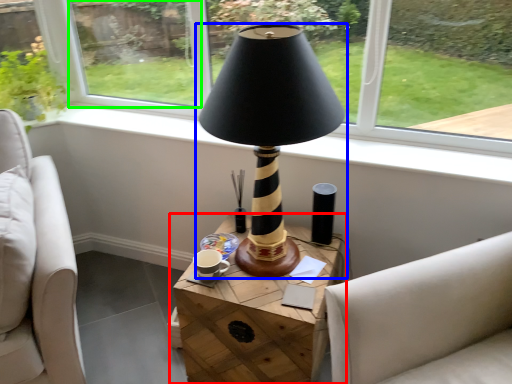
Question: Which object is positioned farthest from table (highlighted by a red box)? Select from lamp (highlighted by a blue box) and window screen (highlighted by a green box).

Choices:
 (A) lamp
 (B) window screen

Answer: (B)